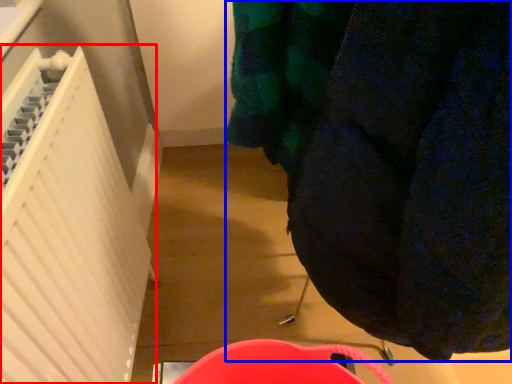
Question: Which point is further to the camera, radiator (highlighted by a red box) or clothing (highlighted by a blue box)?

Choices:
 (A) radiator
 (B) clothing

Answer: (A)